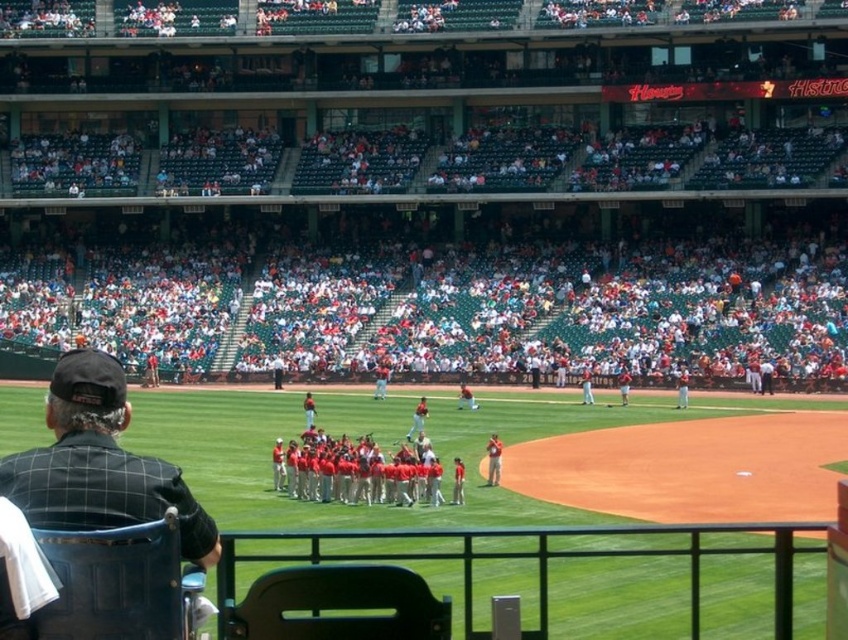
Is black mesh chair at lower left smaller than red uniformed players at center?

No.

Is black mesh chair at lower left positioned before red uniformed players at center?

Yes.

You are a GUI agent. You are given a task and a screenshot of the screen. Output one action in this format:
    pyautogui.click(x=<x>, y=<y>)
    Task: Click on the black mesh chair at lower left
    The height and width of the screenshot is (640, 848).
    Given the screenshot: What is the action you would take?
    pyautogui.click(x=99, y=464)